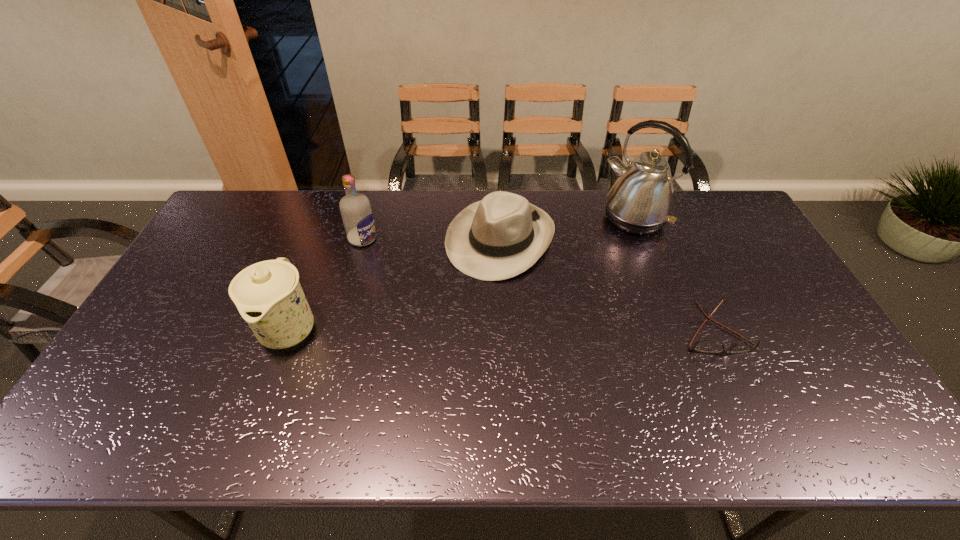
The height and width of the screenshot is (540, 960). In order to click on vacant space at the near edge of the desktop in this screenshot , I will do click(368, 376).

The height and width of the screenshot is (540, 960). I want to click on free space at the right edge of the desktop, so click(x=742, y=249).

Locate an element on the screen. Image resolution: width=960 pixels, height=540 pixels. free space at the far right corner is located at coordinates (714, 207).

Where is `vacant space at the near right corner`? The height and width of the screenshot is (540, 960). vacant space at the near right corner is located at coordinates [x=831, y=403].

You are a GUI agent. You are given a task and a screenshot of the screen. Output one action in this format:
    pyautogui.click(x=<x>, y=<y>)
    Task: Click on the blank region between the second shortest object and the tallest object
    Image resolution: width=960 pixels, height=540 pixels.
    Given the screenshot: What is the action you would take?
    click(567, 229)

Identify the location of free space between the fourth tallest object and the vodka. (432, 239).

Where is `free space between the fedora and the vodka`? The image size is (960, 540). free space between the fedora and the vodka is located at coordinates (432, 239).

Identify the location of vacant space that is in between the kettle and the spectacles. The height and width of the screenshot is (540, 960). (674, 275).

Locate an element on the screen. The image size is (960, 540). free spot between the spectacles and the chinaware is located at coordinates (502, 330).

At what (x,y) coordinates should I click in order to perform the action: click on free space between the vodka and the fedora. Please return your answer as a coordinate pair (x, y). The height and width of the screenshot is (540, 960). Looking at the image, I should click on (432, 239).